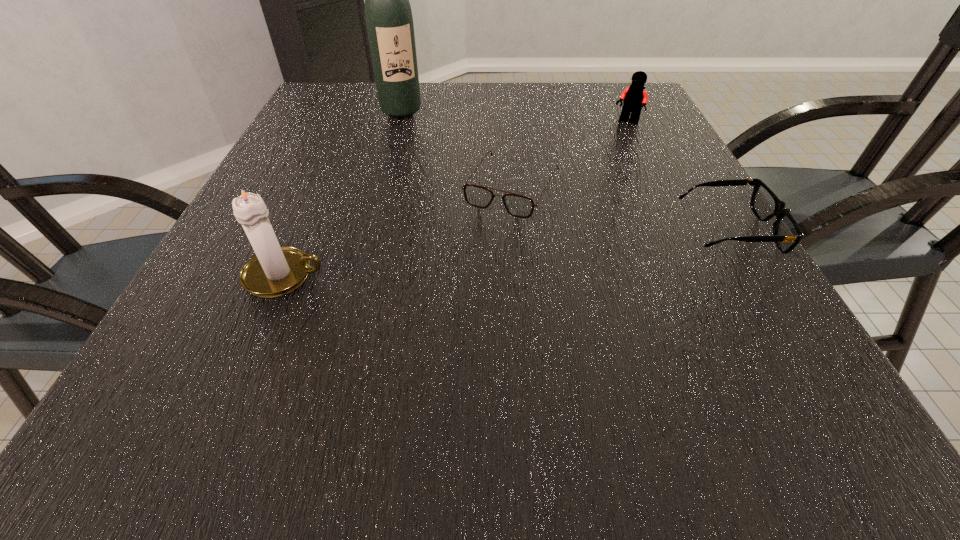
Identify the location of vacant area in the image that satisfies the following two spatial constraints: 1. on the front side of the third shortest object; 2. on the left side of the wine bottle. (398, 122).

Identify the location of vacant area in the image that satisfies the following two spatial constraints: 1. on the front side of the fourth object from right to left; 2. on the right side of the left sunglasses. (380, 189).

Where is `vacant point that satisfies the following two spatial constraints: 1. on the front side of the wine bottle; 2. on the left side of the left sunglasses`? vacant point that satisfies the following two spatial constraints: 1. on the front side of the wine bottle; 2. on the left side of the left sunglasses is located at coordinates tap(380, 189).